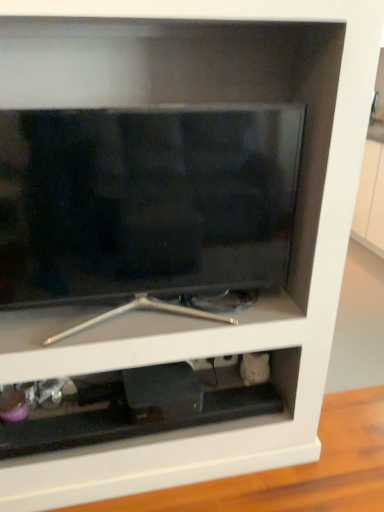
Question: Is matte black tv at center to the left or to the right of black plastic cabinet at lower center in the image?

Choices:
 (A) right
 (B) left

Answer: (A)

Question: From their relative heights in the image, would you say matte black tv at center is taller or shorter than black plastic cabinet at lower center?

Choices:
 (A) short
 (B) tall

Answer: (B)

Question: In terms of size, does matte black tv at center appear bigger or smaller than black plastic cabinet at lower center?

Choices:
 (A) big
 (B) small

Answer: (A)

Question: From a real-world perspective, is black plastic cabinet at lower center physically located above or below matte black tv at center?

Choices:
 (A) above
 (B) below

Answer: (B)

Question: Relative to matte black tv at center, is black plastic cabinet at lower center in front or behind?

Choices:
 (A) behind
 (B) front

Answer: (A)

Question: In the image, is black plastic cabinet at lower center on the left side or the right side of matte black tv at center?

Choices:
 (A) left
 (B) right

Answer: (A)

Question: Based on their sizes in the image, would you say black plastic cabinet at lower center is bigger or smaller than matte black tv at center?

Choices:
 (A) small
 (B) big

Answer: (A)